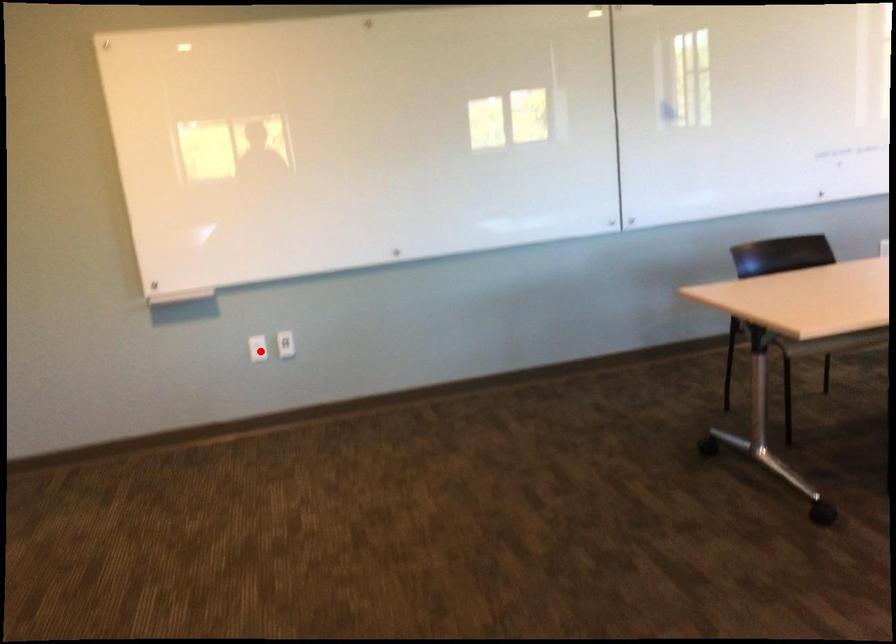
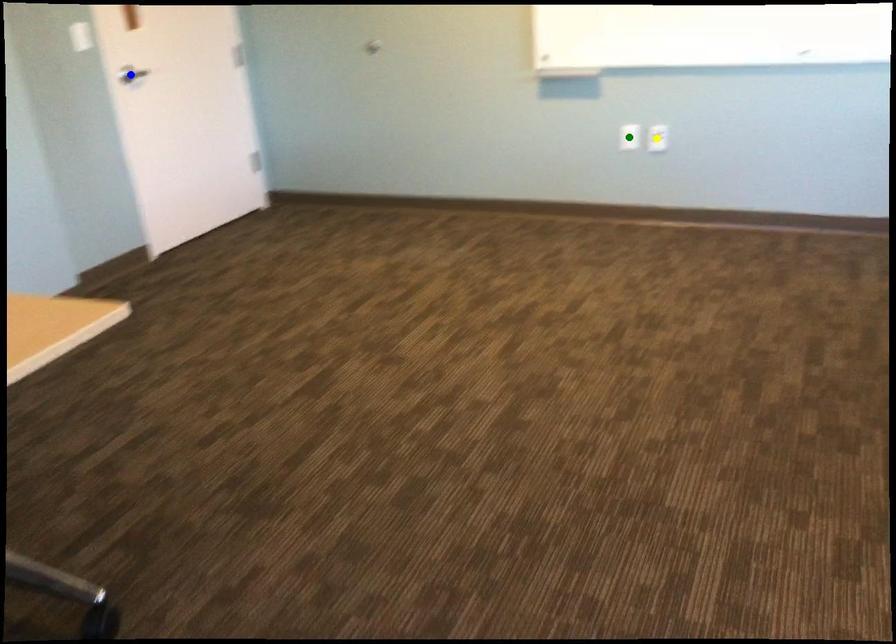
Question: I am providing you with two images of the same scene from different viewpoints. A red point is marked on the first image. You are given multiple points on the second image. Which point in image 2 is actually the same real-world point as the red point in image 1?

Choices:
 (A) green point
 (B) blue point
 (C) yellow point

Answer: (A)